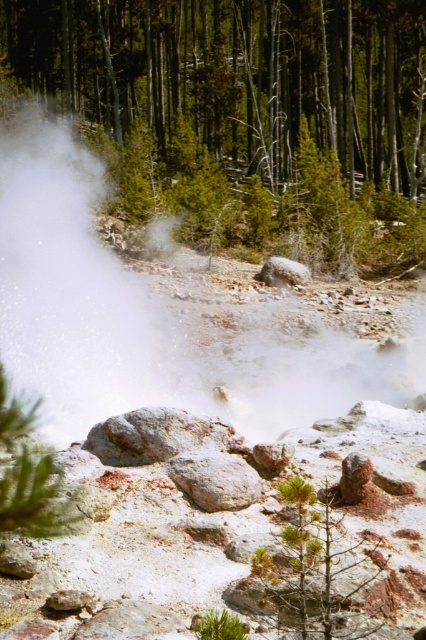
You are standing at the origin point in the geothermal area. You see two points marked on the terrain. Which of the two points, point (28, 8) or point (89, 195), is farther away from you?

Point (28, 8) is behind point (89, 195), so it is farther away from you.

You are a hiker in the geothermal area. You see the green matte tree at upper center and the white vapor at center. Which one is higher in the scene?

The green matte tree at upper center is taller than the white vapor at center.